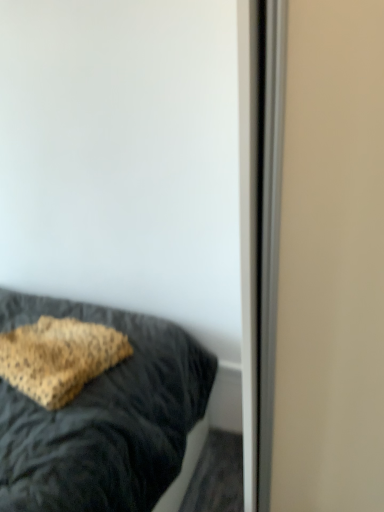
Question: Is leopard print pillow at center at the left side of leopard print fabric pillow at lower left?

Choices:
 (A) no
 (B) yes

Answer: (B)

Question: From the image's perspective, is leopard print pillow at center beneath leopard print fabric pillow at lower left?

Choices:
 (A) yes
 (B) no

Answer: (A)

Question: Is leopard print pillow at center positioned far away from leopard print fabric pillow at lower left?

Choices:
 (A) yes
 (B) no

Answer: (B)

Question: Considering the relative sizes of leopard print pillow at center and leopard print fabric pillow at lower left in the image provided, is leopard print pillow at center thinner than leopard print fabric pillow at lower left?

Choices:
 (A) yes
 (B) no

Answer: (B)

Question: Does leopard print pillow at center have a greater width compared to leopard print fabric pillow at lower left?

Choices:
 (A) yes
 (B) no

Answer: (A)

Question: Is leopard print pillow at center positioned behind leopard print fabric pillow at lower left?

Choices:
 (A) no
 (B) yes

Answer: (A)

Question: From a real-world perspective, is leopard print fabric pillow at lower left under leopard print pillow at center?

Choices:
 (A) yes
 (B) no

Answer: (B)

Question: From the image's perspective, is leopard print fabric pillow at lower left on top of leopard print pillow at center?

Choices:
 (A) yes
 (B) no

Answer: (A)

Question: From a real-world perspective, does leopard print fabric pillow at lower left stand above leopard print pillow at center?

Choices:
 (A) no
 (B) yes

Answer: (B)

Question: Could you tell me if leopard print fabric pillow at lower left is facing leopard print pillow at center?

Choices:
 (A) no
 (B) yes

Answer: (B)

Question: Are leopard print fabric pillow at lower left and leopard print pillow at center located far from each other?

Choices:
 (A) yes
 (B) no

Answer: (B)

Question: Can you confirm if leopard print fabric pillow at lower left is taller than leopard print pillow at center?

Choices:
 (A) no
 (B) yes

Answer: (A)

Question: Do you think leopard print fabric pillow at lower left is within leopard print pillow at center, or outside of it?

Choices:
 (A) inside
 (B) outside

Answer: (A)